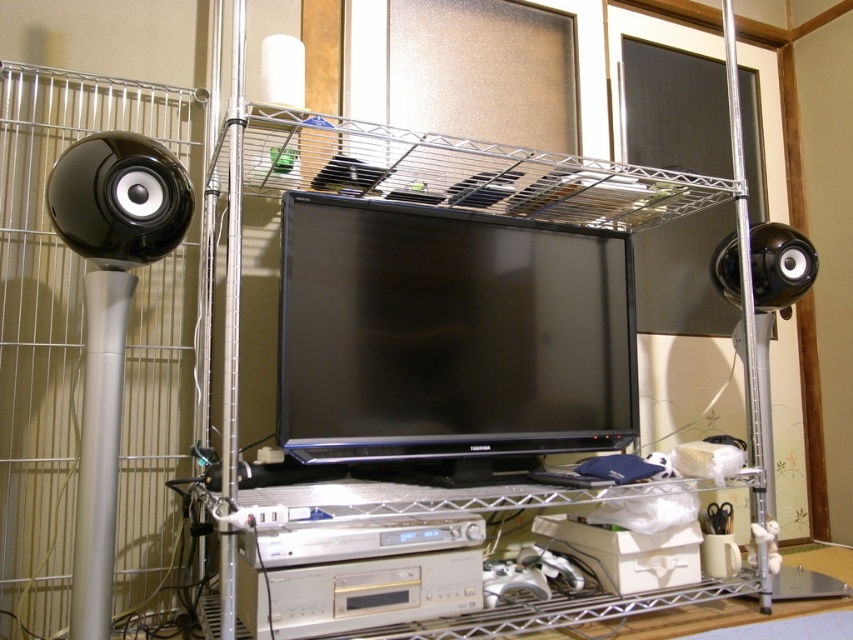
Question: Observing the image, what is the correct spatial positioning of satin black monitor at center in reference to black glossy flat screen tv at center?

Choices:
 (A) above
 (B) below

Answer: (A)

Question: Considering the relative positions of glossy black speaker at left and black glossy speaker at right in the image provided, where is glossy black speaker at left located with respect to black glossy speaker at right?

Choices:
 (A) right
 (B) left

Answer: (B)

Question: Which object appears farthest from the camera in this image?

Choices:
 (A) black glossy speaker at left
 (B) black glossy speaker at right

Answer: (B)

Question: Can you confirm if satin black monitor at center is positioned below black glossy flat screen tv at center?

Choices:
 (A) no
 (B) yes

Answer: (A)

Question: Which point is closer to the camera?

Choices:
 (A) glossy black speaker at left
 (B) black glossy flat screen tv at center
 (C) black glossy speaker at right
 (D) black glossy speaker at left

Answer: (A)

Question: Estimate the real-world distances between objects in this image. Which object is closer to the black glossy flat screen tv at center?

Choices:
 (A) satin black monitor at center
 (B) black glossy speaker at left
 (C) glossy black speaker at left
 (D) black glossy speaker at right

Answer: (A)